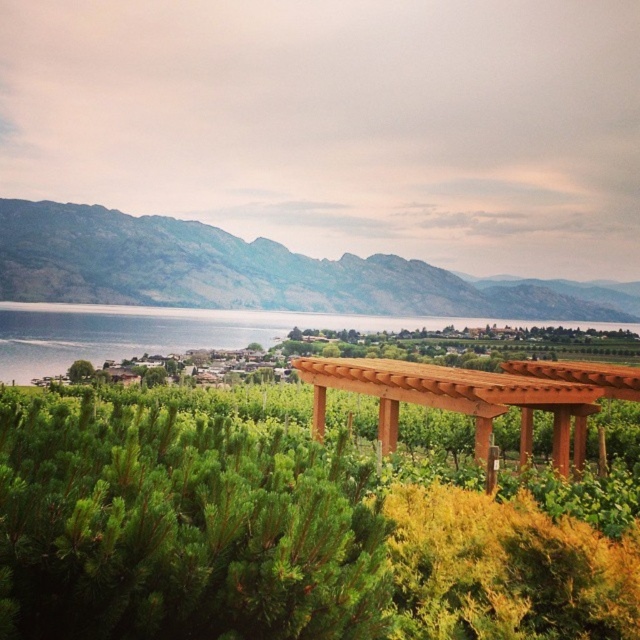
Question: Is gray rock mountain at upper left below green leafy tree at lower left?

Choices:
 (A) yes
 (B) no

Answer: (B)

Question: Does gray rock mountain at upper left appear on the right side of brown wooden pergola at center?

Choices:
 (A) yes
 (B) no

Answer: (B)

Question: Is gray rock mountain at upper left smaller than brown wooden pergola at center?

Choices:
 (A) no
 (B) yes

Answer: (A)

Question: Which point is farther to the camera?

Choices:
 (A) gray rock mountain at upper left
 (B) green leafy tree at lower left
 (C) brown wooden pergola at center

Answer: (A)

Question: Which point is closer to the camera?

Choices:
 (A) (54, 209)
 (B) (93, 371)

Answer: (B)

Question: Which point is farther to the camera?

Choices:
 (A) (83, 381)
 (B) (401, 285)
 (C) (554, 435)

Answer: (B)